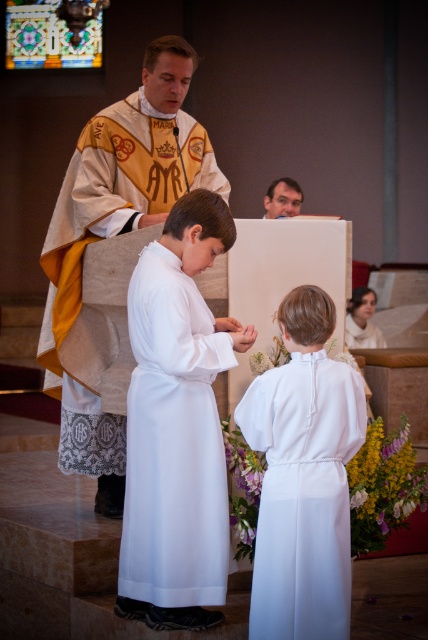
You are an attendee at this religious ceremony. You notice two robes at the center of the scene. Which robe is closer to you, the white satin robe at center or the gold embroidered robe at center?

The white satin robe at center is closer to you because it is positioned under the gold embroidered robe at center, indicating it is in front.

From the picture: You are standing in the church and want to place a small offering at the base of the gold embroidered robe at center. Based on its 2D coordinates, where should you walk to in the church? Please provide the coordinates in the format of a point like this example format, e.g., point 0.3, 0.4.

The gold embroidered robe at center is located at point (115,234), so you should walk to point (115,234) to place the offering.